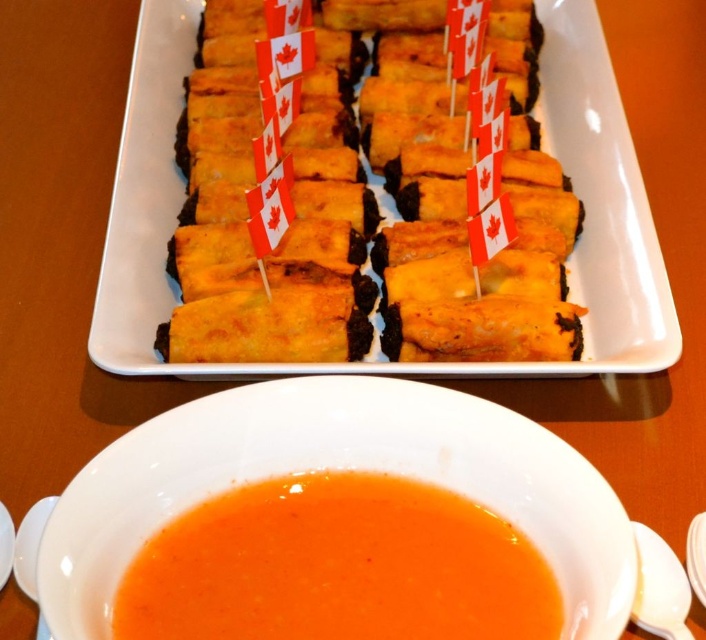
Question: Based on their relative distances, which object is farther from the orange smoothie at lower center?

Choices:
 (A) white ceramic bowl at center
 (B) golden crispy spring rolls at center

Answer: (B)

Question: Is golden crispy spring rolls at center smaller than orange smoothie at lower center?

Choices:
 (A) yes
 (B) no

Answer: (B)

Question: Can you confirm if golden crispy spring rolls at center is thinner than orange smoothie at lower center?

Choices:
 (A) yes
 (B) no

Answer: (B)

Question: Which object appears closest to the camera in this image?

Choices:
 (A) white ceramic bowl at center
 (B) golden crispy spring rolls at center

Answer: (A)

Question: Is white ceramic bowl at center below orange smoothie at lower center?

Choices:
 (A) no
 (B) yes

Answer: (A)

Question: Which of the following is the farthest from the observer?

Choices:
 (A) white ceramic bowl at center
 (B) orange smoothie at lower center

Answer: (B)